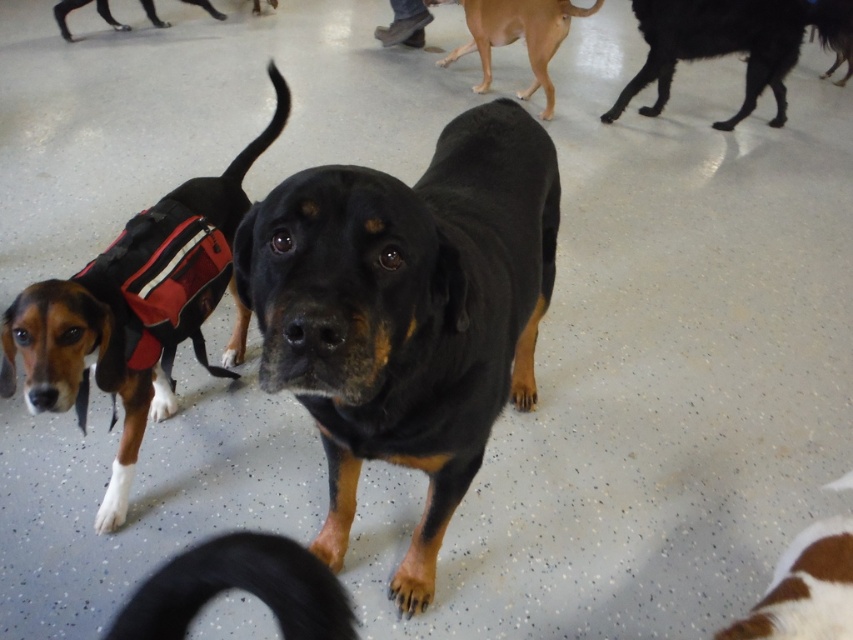
Is point (440, 262) farther from camera compared to point (610, 122)?

No.

Which of these two, black smooth dog at center or black fur dog at upper right, stands taller?

With more height is black smooth dog at center.

Is point (316, 381) positioned before point (722, 52)?

Yes, point (316, 381) is in front of point (722, 52).

Locate an element on the screen. This screenshot has height=640, width=853. black smooth dog at center is located at coordinates (407, 310).

Does brown/black fur dog at left have a smaller size compared to black smooth dog at upper left?

No, brown/black fur dog at left is not smaller than black smooth dog at upper left.

This screenshot has width=853, height=640. What are the coordinates of `brown/black fur dog at left` in the screenshot? It's located at (138, 308).

You are a GUI agent. You are given a task and a screenshot of the screen. Output one action in this format:
    pyautogui.click(x=<x>, y=<y>)
    Task: Click on the brown/black fur dog at left
    
    Given the screenshot: What is the action you would take?
    pyautogui.click(x=138, y=308)

Which is behind, point (465, 378) or point (502, 35)?

Positioned behind is point (502, 35).

Is point (303, 243) positioned after point (486, 13)?

No, it is in front of (486, 13).

Image resolution: width=853 pixels, height=640 pixels. Identify the location of black smooth dog at center. (407, 310).